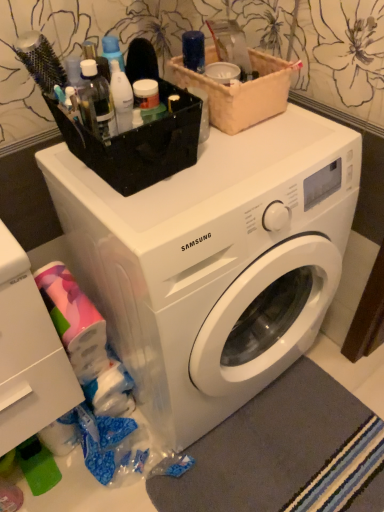
This screenshot has width=384, height=512. Identify the location of free space in front of beige fabric basket at upper center. (264, 153).